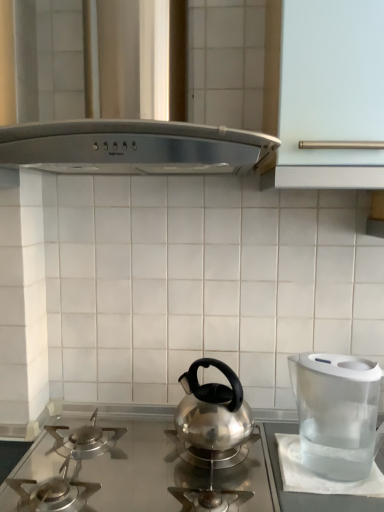
Identify the location of satin silver vent at upper center. click(x=155, y=100).

The width and height of the screenshot is (384, 512). What do you see at coordinates (140, 463) in the screenshot?
I see `satin silver gas stove at center` at bounding box center [140, 463].

The image size is (384, 512). Identify the location of satin silver vent at upper center. (155, 100).

From a real-world perspective, relative to transparent plastic water filter at right, is satin silver vent at upper center vertically above or below?

From a real-world perspective, satin silver vent at upper center is physically above transparent plastic water filter at right.

Is point (113, 151) positioned in front of point (351, 395)?

Yes, it is in front of point (351, 395).

Looking at this image, considering the sizes of objects satin silver vent at upper center and transparent plastic water filter at right in the image provided, who is taller, satin silver vent at upper center or transparent plastic water filter at right?

With more height is satin silver vent at upper center.

Between satin silver vent at upper center and transparent plastic water filter at right, which one appears on the left side from the viewer's perspective?

From the viewer's perspective, satin silver vent at upper center appears more on the left side.

From the picture: Does satin silver gas stove at center have a lesser height compared to transparent plastic water filter at right?

Indeed, satin silver gas stove at center has a lesser height compared to transparent plastic water filter at right.

Is transparent plastic water filter at right at the back of satin silver gas stove at center?

satin silver gas stove at center is not turned away from transparent plastic water filter at right.

Based on the photo, who is bigger, satin silver gas stove at center or transparent plastic water filter at right?

With larger size is satin silver gas stove at center.

Is point (360, 497) behind point (323, 444)?

No, (360, 497) is closer to viewer.

Is transparent plastic water filter at right outside of satin silver vent at upper center?

transparent plastic water filter at right lies outside satin silver vent at upper center's area.

From the picture: From a real-world perspective, is transparent plastic water filter at right physically located above or below satin silver vent at upper center?

In terms of real-world spatial position, transparent plastic water filter at right is below satin silver vent at upper center.

Is transparent plastic water filter at right wider or thinner than satin silver vent at upper center?

Clearly, transparent plastic water filter at right has less width compared to satin silver vent at upper center.

What's the angular difference between transparent plastic water filter at right and satin silver gas stove at center's facing directions?

There is a 93.7-degree angle between the facing directions of transparent plastic water filter at right and satin silver gas stove at center.

Is transparent plastic water filter at right inside the boundaries of satin silver gas stove at center, or outside?

transparent plastic water filter at right is not inside satin silver gas stove at center, it's outside.

Who is taller, transparent plastic water filter at right or satin silver gas stove at center?

transparent plastic water filter at right.

Is satin silver gas stove at center aimed at satin silver vent at upper center?

No, satin silver gas stove at center is not oriented towards satin silver vent at upper center.

Is satin silver gas stove at center positioned beyond the bounds of satin silver vent at upper center?

satin silver gas stove at center lies outside satin silver vent at upper center's area.

Consider the image. Based on their sizes in the image, would you say satin silver gas stove at center is bigger or smaller than satin silver vent at upper center?

Clearly, satin silver gas stove at center is smaller in size than satin silver vent at upper center.

Does point (213, 31) come in front of point (116, 468)?

Yes, it is in front of point (116, 468).

Considering the relative sizes of satin silver vent at upper center and satin silver gas stove at center in the image provided, is satin silver vent at upper center taller than satin silver gas stove at center?

Correct, satin silver vent at upper center is much taller as satin silver gas stove at center.

How many degrees apart are the facing directions of satin silver vent at upper center and satin silver gas stove at center?

The angle between the facing direction of satin silver vent at upper center and the facing direction of satin silver gas stove at center is 0.595 degrees.

From the image's perspective, is satin silver vent at upper center above or below satin silver gas stove at center?

Clearly, from the image's perspective, satin silver vent at upper center is above satin silver gas stove at center.

Locate an element on the screen. kitchen appliance behind the satin silver vent at upper center is located at coordinates (336, 413).

Find the location of a particular element. The width and height of the screenshot is (384, 512). kitchen appliance positioned vertically above the satin silver gas stove at center (from a real-world perspective) is located at coordinates [x=336, y=413].

When comparing their distances from satin silver gas stove at center, does transparent plastic water filter at right or satin silver vent at upper center seem further?

satin silver vent at upper center is further to satin silver gas stove at center.

Based on their spatial positions, is satin silver gas stove at center or satin silver vent at upper center further from transparent plastic water filter at right?

satin silver vent at upper center lies further to transparent plastic water filter at right than the other object.

Based on their spatial positions, is satin silver gas stove at center or transparent plastic water filter at right closer to satin silver vent at upper center?

Among the two, transparent plastic water filter at right is located nearer to satin silver vent at upper center.

From the picture: When comparing their distances from transparent plastic water filter at right, does satin silver vent at upper center or satin silver gas stove at center seem further?

satin silver vent at upper center lies further to transparent plastic water filter at right than the other object.

Which object lies further to the anchor point satin silver gas stove at center, satin silver vent at upper center or transparent plastic water filter at right?

satin silver vent at upper center is further to satin silver gas stove at center.

Which object lies nearer to the anchor point satin silver vent at upper center, transparent plastic water filter at right or satin silver gas stove at center?

transparent plastic water filter at right lies closer to satin silver vent at upper center than the other object.

In order to click on kitchen appliance between satin silver vent at upper center and satin silver gas stove at center in the vertical direction in this screenshot , I will do `click(336, 413)`.